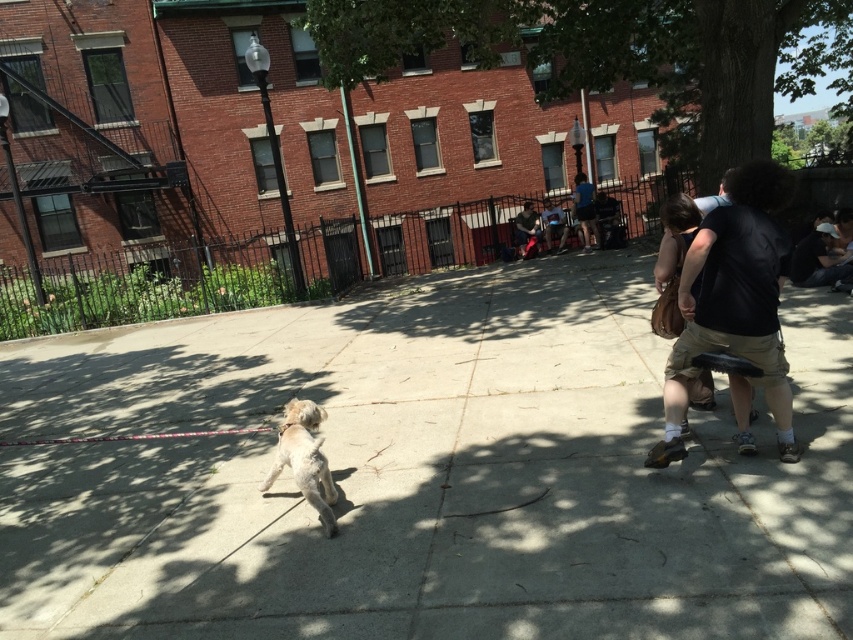
Does blue fabric shirt at upper right lie behind dark blue jeans at center?

No, blue fabric shirt at upper right is in front of dark blue jeans at center.

Who is shorter, blue fabric shirt at upper right or dark blue jeans at center?

dark blue jeans at center

At what (x,y) coordinates should I click in order to perform the action: click on blue fabric shirt at upper right. Please return your answer as a coordinate pair (x, y). This screenshot has height=640, width=853. Looking at the image, I should click on (585, 209).

Who is positioned more to the right, smooth concrete pavement at center or dark blue jeans at center?

dark blue jeans at center

Does smooth concrete pavement at center have a larger size compared to dark blue jeans at center?

Indeed, smooth concrete pavement at center has a larger size compared to dark blue jeans at center.

Where is `smooth concrete pavement at center`? The height and width of the screenshot is (640, 853). smooth concrete pavement at center is located at coordinates (424, 474).

Who is higher up, dark brown leather jacket at right or light brown fur at lower left?

dark brown leather jacket at right

Does dark brown leather jacket at right have a greater height compared to light brown fur at lower left?

Indeed, dark brown leather jacket at right has a greater height compared to light brown fur at lower left.

Which is in front, point (700, 269) or point (323, 456)?

Point (700, 269) is in front.

This screenshot has width=853, height=640. Identify the location of dark brown leather jacket at right. (733, 301).